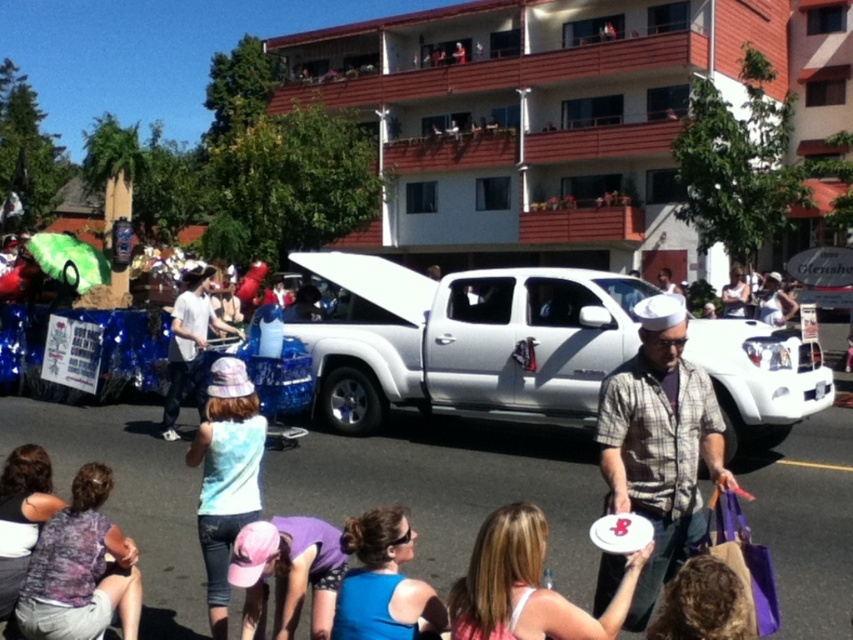
Can you confirm if white metallic pickup truck at center is positioned below white cotton shirt at center?

Incorrect, white metallic pickup truck at center is not positioned below white cotton shirt at center.

Measure the distance between white metallic pickup truck at center and white cotton shirt at center.

The distance of white metallic pickup truck at center from white cotton shirt at center is 4.92 meters.

Does point (326, 417) come in front of point (186, 340)?

No, (326, 417) is further to viewer.

The height and width of the screenshot is (640, 853). I want to click on white metallic pickup truck at center, so click(465, 340).

Can you confirm if light purple tie-dye shirt at lower left is thinner than blue fabric shirt at center?

Incorrect, light purple tie-dye shirt at lower left's width is not less than blue fabric shirt at center's.

Is point (103, 627) behind point (415, 624)?

That is True.

The width and height of the screenshot is (853, 640). I want to click on light purple tie-dye shirt at lower left, so click(x=80, y=570).

Locate an element on the screen. This screenshot has height=640, width=853. light purple tie-dye shirt at lower left is located at coordinates (80, 570).

Which is in front, point (397, 326) or point (408, 545)?

Point (408, 545) is in front.

Does point (357, 275) lie behind point (387, 570)?

Yes, point (357, 275) is farther from viewer.

Locate an element on the screen. The image size is (853, 640). white metallic pickup truck at center is located at coordinates (465, 340).